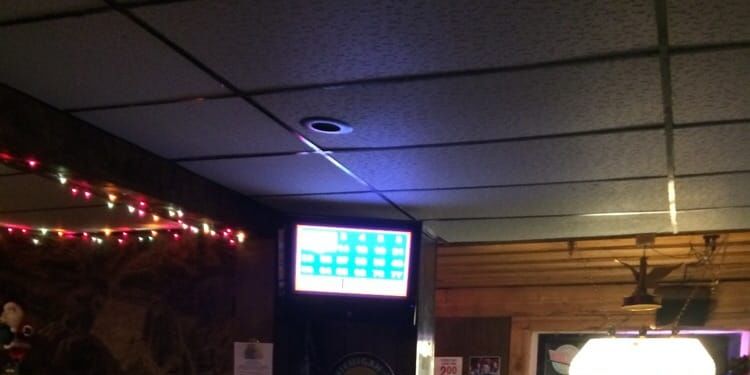
I want to click on white rectangular ceiling board, so click(x=495, y=95).